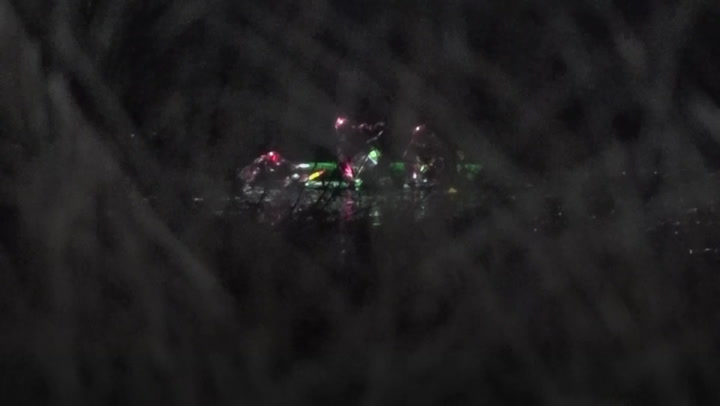
Locate an element on the screen. This screenshot has width=720, height=406. yellow light is located at coordinates (315, 177).